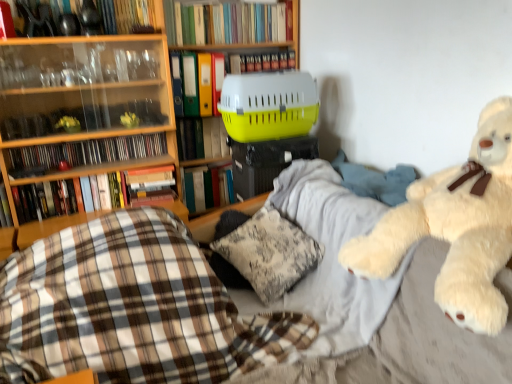
What do you see at coordinates (263, 62) in the screenshot? The height and width of the screenshot is (384, 512). I see `hardcover book at upper center, positioned as the 7th book in bottom-to-top order` at bounding box center [263, 62].

Image resolution: width=512 pixels, height=384 pixels. What do you see at coordinates (234, 30) in the screenshot?
I see `yellow plastic pet carrier at center` at bounding box center [234, 30].

Measure the distance between point [143,22] and camera.

Point [143,22] and camera are 7.21 feet apart from each other.

What is the approximate height of yellow plastic pet carrier at center, which is counted as the fifth book, starting from the top?

8.70 inches.

You are a GUI agent. You are given a task and a screenshot of the screen. Output one action in this format:
    pyautogui.click(x=<x>, y=<y>)
    Task: Click on the yellow plastic file at center, placed as the fourth book when sorted from top to bottom
    
    Given the screenshot: What is the action you would take?
    pyautogui.click(x=198, y=81)

What do you see at coordinates (207, 187) in the screenshot? I see `hardcover book at center, the 3th book ordered from the bottom` at bounding box center [207, 187].

You are a GUI agent. You are given a task and a screenshot of the screen. Output one action in this format:
    pyautogui.click(x=<x>, y=<y>)
    Task: Click on the hardcover book at upper center, positioned as the 7th book in bottom-to-top order
    The image size is (512, 384).
    Given the screenshot: What is the action you would take?
    pyautogui.click(x=263, y=62)

Is hardcover book at left, placed as the 8th book when sorted from top to bottom, positioned with its back to fluffy white teddy bear at right?

No, hardcover book at left, placed as the 8th book when sorted from top to bottom, is not facing the opposite direction of fluffy white teddy bear at right.

From a real-world perspective, is hardcover book at left, placed as the 8th book when sorted from top to bottom, below fluffy white teddy bear at right?

Indeed, from a real-world perspective, hardcover book at left, placed as the 8th book when sorted from top to bottom, is positioned beneath fluffy white teddy bear at right.

Is fluffy white teddy bear at right surrounded by hardcover book at left, placed as the 8th book when sorted from top to bottom?

No, fluffy white teddy bear at right is located outside of hardcover book at left, placed as the 8th book when sorted from top to bottom.

Based on the photo, measure the distance between plaid fabric at center and hardcover book at upper left, the eighth book when ordered from bottom to top.

plaid fabric at center is 1.30 meters away from hardcover book at upper left, the eighth book when ordered from bottom to top.

Considering the relative positions of plaid fabric at center and hardcover book at upper left, the eighth book when ordered from bottom to top, in the image provided, is plaid fabric at center to the right of hardcover book at upper left, the eighth book when ordered from bottom to top, from the viewer's perspective?

Yes.

Is point (203, 263) positioned before point (22, 14)?

That is True.

Looking at this image, from the image's perspective, is plaid fabric at center on hardcover book at upper left, which appears as the second book when viewed from the top?

No, from the image's perspective, plaid fabric at center is not over hardcover book at upper left, which appears as the second book when viewed from the top.

From a real-world perspective, between hardcover book at upper center, positioned as the 7th book in bottom-to-top order, and plastic cd case at upper left, the 4th book ordered from the bottom, who is vertically higher?

hardcover book at upper center, positioned as the 7th book in bottom-to-top order, from a real-world perspective.

Is point (240, 72) in front of point (153, 156)?

No.

Is plastic cd case at upper left, acting as the sixth book starting from the top, completely or partially inside hardcover book at upper center, positioned as the 7th book in bottom-to-top order?

No, plastic cd case at upper left, acting as the sixth book starting from the top, is not a part of hardcover book at upper center, positioned as the 7th book in bottom-to-top order.

How different are the orientations of hardcover book at upper center, positioned as the 7th book in bottom-to-top order, and plastic cd case at upper left, the 4th book ordered from the bottom, in degrees?

They differ by 1.12 degrees in their facing directions.

Can you confirm if hardcover book at upper center, positioned as the ninth book in bottom-to-top order, is taller than plastic cd case at upper left, acting as the sixth book starting from the top?

Yes, hardcover book at upper center, positioned as the ninth book in bottom-to-top order, is taller than plastic cd case at upper left, acting as the sixth book starting from the top.

Does hardcover book at upper center, positioned as the ninth book in bottom-to-top order, touch plastic cd case at upper left, acting as the sixth book starting from the top?

hardcover book at upper center, positioned as the ninth book in bottom-to-top order, is not next to plastic cd case at upper left, acting as the sixth book starting from the top, and they're not touching.

Is hardcover book at upper center, which appears as the 1th book when viewed from the top, facing towards plastic cd case at upper left, acting as the sixth book starting from the top?

No, hardcover book at upper center, which appears as the 1th book when viewed from the top, is not aimed at plastic cd case at upper left, acting as the sixth book starting from the top.

From a real-world perspective, starting from the fluffy white teddy bear at right, which book is the 3rd one vertically above it? Please provide its 2D coordinates.

[(228, 23)]

Looking at this image, from the image's perspective, is fluffy white teddy bear at right located beneath hardcover book at upper center, positioned as the ninth book in bottom-to-top order?

Correct, fluffy white teddy bear at right appears lower than hardcover book at upper center, positioned as the ninth book in bottom-to-top order, in the image.

Measure the distance between fluffy white teddy bear at right and hardcover book at upper center, which appears as the 1th book when viewed from the top.

They are 1.59 meters apart.

Does point (389, 271) come closer to viewer compared to point (274, 22)?

Yes, it is.

Is hardcover book at center, the 3th book ordered from the bottom, aimed at hardcover book at upper left, the eighth book when ordered from bottom to top?

No, hardcover book at center, the 3th book ordered from the bottom, is not facing towards hardcover book at upper left, the eighth book when ordered from bottom to top.

Is hardcover book at center, the 3th book ordered from the bottom, located outside hardcover book at upper left, the eighth book when ordered from bottom to top?

Yes.

Is hardcover book at center, the 3th book ordered from the bottom, wider than hardcover book at upper left, the eighth book when ordered from bottom to top?

No.

Based on the photo, from the image's perspective, relative to hardcover book at upper left, which appears as the second book when viewed from the top, is hardcover book at center, the 3th book ordered from the bottom, above or below?

From the image's perspective, hardcover book at center, the 3th book ordered from the bottom, appears below hardcover book at upper left, which appears as the second book when viewed from the top.

From the image's perspective, is hardcover book at upper center, positioned as the 7th book in bottom-to-top order, on top of hardcover book at center, the seventh book from the top?

Correct, hardcover book at upper center, positioned as the 7th book in bottom-to-top order, appears higher than hardcover book at center, the seventh book from the top, in the image.

In the scene shown: Are hardcover book at upper center, positioned as the 7th book in bottom-to-top order, and hardcover book at center, the seventh book from the top, far apart?

No, hardcover book at upper center, positioned as the 7th book in bottom-to-top order, is not far from hardcover book at center, the seventh book from the top.

Which of these two, hardcover book at upper center, placed as the third book when sorted from top to bottom, or hardcover book at center, the seventh book from the top, stands taller?

With more height is hardcover book at center, the seventh book from the top.

Considering the sizes of objects hardcover book at upper center, positioned as the 7th book in bottom-to-top order, and hardcover book at center, the seventh book from the top, in the image provided, who is thinner, hardcover book at upper center, positioned as the 7th book in bottom-to-top order, or hardcover book at center, the seventh book from the top,?

With smaller width is hardcover book at center, the seventh book from the top.

At what (x,y) coordinates should I click in order to perform the action: click on teddy bear above the hardcover book at left, placed as the 8th book when sorted from top to bottom (from a real-world perspective). Please return your answer as a coordinate pair (x, y). The width and height of the screenshot is (512, 384). Looking at the image, I should click on (455, 227).

Find the location of a particular element. This screenshot has height=384, width=512. plaid in front of the hardcover book at upper left, the eighth book when ordered from bottom to top is located at coordinates (131, 308).

Based on the photo, which object lies further to the anchor point hardcover book at upper left, which appears as the second book when viewed from the top, hardcover book at upper center, which appears as the 1th book when viewed from the top, or plastic cd case at upper left, acting as the sixth book starting from the top?

plastic cd case at upper left, acting as the sixth book starting from the top, is positioned further to the anchor hardcover book at upper left, which appears as the second book when viewed from the top.

Based on their spatial positions, is hardcover book at left, placed as the 8th book when sorted from top to bottom, or plastic cd case at upper left, acting as the sixth book starting from the top, closer to fluffy white teddy bear at right?

hardcover book at left, placed as the 8th book when sorted from top to bottom, is closer to fluffy white teddy bear at right.

Considering their positions, is hardcover book at upper left, the eighth book when ordered from bottom to top, positioned closer to yellow plastic pet carrier at center, positioned as the fifth book in bottom-to-top order, than hardcover book at center, the seventh book from the top?

hardcover book at center, the seventh book from the top.

Which object lies further to the anchor point fluffy white teddy bear at right, hardcover book at upper left, the eighth book when ordered from bottom to top, or yellow plastic pet carrier at center?

hardcover book at upper left, the eighth book when ordered from bottom to top, lies further to fluffy white teddy bear at right than the other object.

When comparing their distances from hardcover book at center, the seventh book from the top, does hardcover book at upper left, which appears as the second book when viewed from the top, or hardcover book at left, arranged as the 1th book when ordered from the bottom, seem closer?

hardcover book at upper left, which appears as the second book when viewed from the top.

Estimate the real-world distances between objects in this image. Which object is closer to fluffy white teddy bear at right, yellow plastic pet carrier at center, positioned as the fifth book in bottom-to-top order, or hardcover book at upper center, placed as the third book when sorted from top to bottom?

yellow plastic pet carrier at center, positioned as the fifth book in bottom-to-top order, lies closer to fluffy white teddy bear at right than the other object.

When comparing their distances from yellow plastic file at center, placed as the fourth book when sorted from top to bottom, does hardcover book at upper center, which appears as the 1th book when viewed from the top, or plastic cd case at upper left, the 4th book ordered from the bottom, seem further?

plastic cd case at upper left, the 4th book ordered from the bottom, is further to yellow plastic file at center, placed as the fourth book when sorted from top to bottom.

In the scene shown: From the image, which object appears to be nearer to fluffy white teddy bear at right, plastic cd case at upper left, the 4th book ordered from the bottom, or hardcover book at upper center, positioned as the 7th book in bottom-to-top order?

Among the two, hardcover book at upper center, positioned as the 7th book in bottom-to-top order, is located nearer to fluffy white teddy bear at right.

Where is `bookcase between yellow plastic file at center, placed as the fourth book when sorted from top to bottom, and yellow plastic pet carrier at center, positioned as the fifth book in bottom-to-top order, in the front-back direction`? Image resolution: width=512 pixels, height=384 pixels. bookcase between yellow plastic file at center, placed as the fourth book when sorted from top to bottom, and yellow plastic pet carrier at center, positioned as the fifth book in bottom-to-top order, in the front-back direction is located at coordinates (234, 30).

Find the location of a particular element. This screenshot has width=512, height=384. bookcase between hardcover book at upper left, which appears as the second book when viewed from the top, and plaid fabric at center, in the vertical direction is located at coordinates pos(234,30).

I want to click on pillow between plaid fabric at center and hardcover book at left, placed as the 8th book when sorted from top to bottom, in the front-back direction, so click(x=262, y=252).

You are a GUI agent. You are given a task and a screenshot of the screen. Output one action in this format:
    pyautogui.click(x=<x>, y=<y>)
    Task: Click on the pillow positioned between plaid fabric at center and yellow plastic file at center, placed as the fourth book when sorted from top to bottom, from near to far
    The image size is (512, 384).
    Given the screenshot: What is the action you would take?
    pyautogui.click(x=262, y=252)